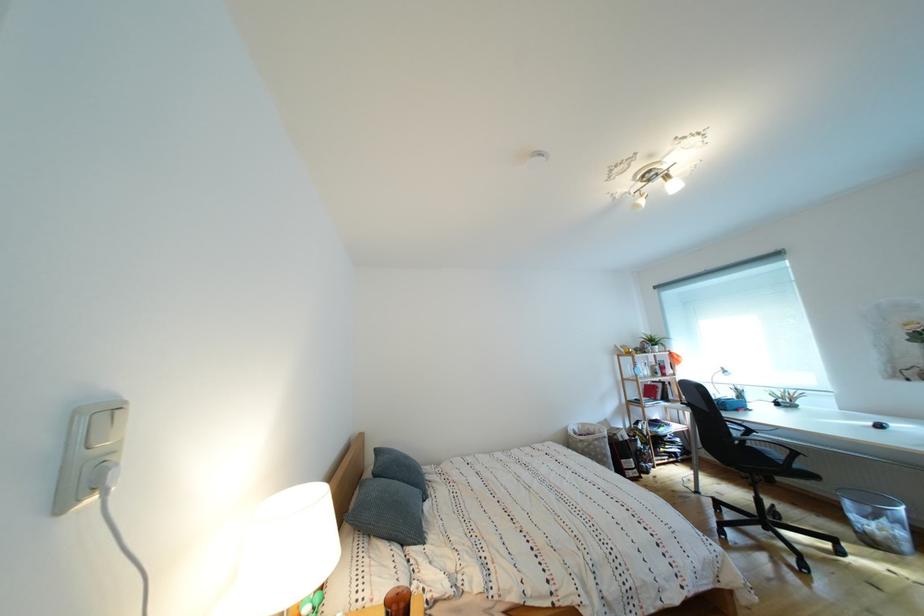
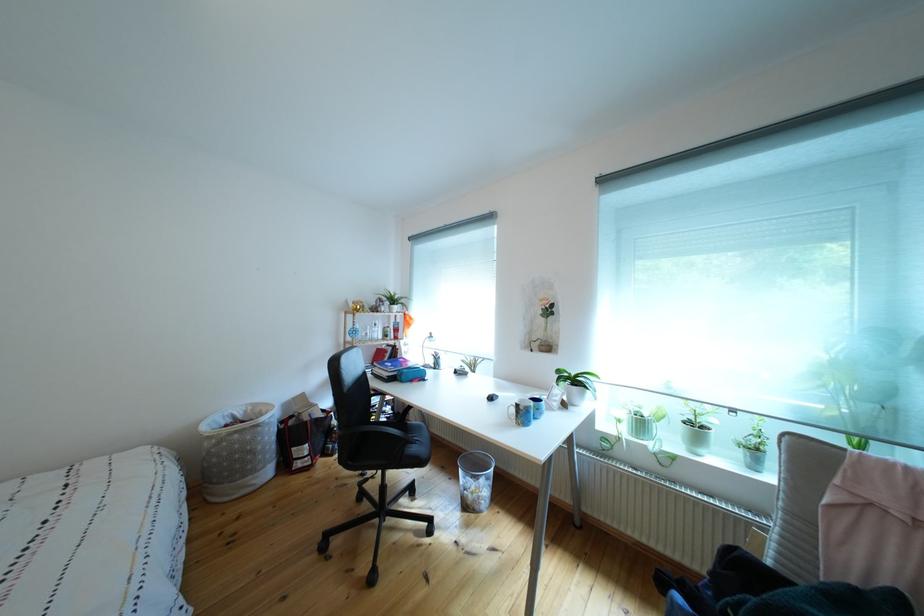
Find the pixel in the second image that matches point 883,548 in the first image.

(477, 512)